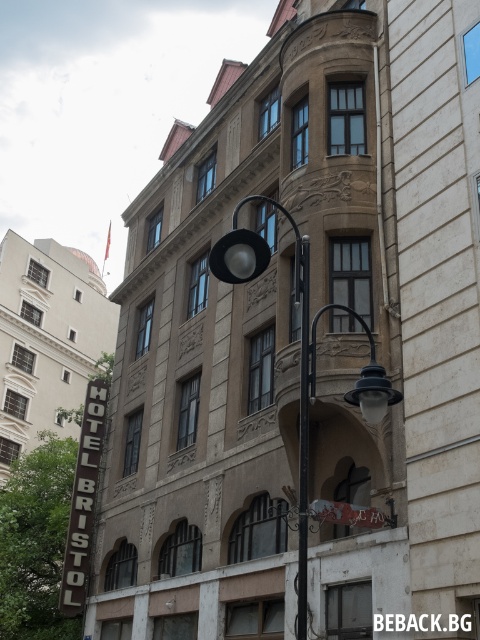
Question: Is black metal pole at center positioned behind metallic silver sign at center?

Choices:
 (A) no
 (B) yes

Answer: (A)

Question: Which point is closer to the camera taking this photo?

Choices:
 (A) (303, 300)
 (B) (325, 512)

Answer: (A)

Question: Can you confirm if black metal pole at center is smaller than metallic silver sign at center?

Choices:
 (A) yes
 (B) no

Answer: (B)

Question: Which point is farther from the camera taking this photo?

Choices:
 (A) (377, 515)
 (B) (304, 614)
 (C) (248, 273)

Answer: (A)

Question: Which point is closer to the camera?

Choices:
 (A) (303, 476)
 (B) (394, 516)
 (C) (304, 337)

Answer: (A)

Question: Can you confirm if matte black lamp post at center is positioned below metallic silver sign at center?

Choices:
 (A) yes
 (B) no

Answer: (B)